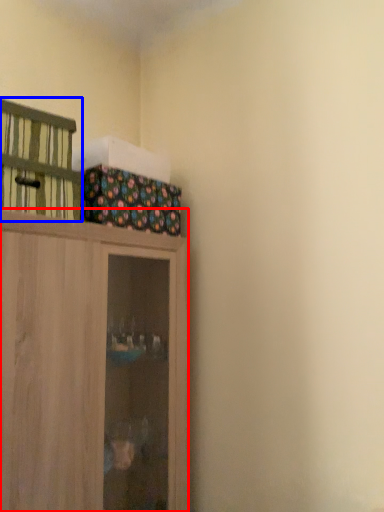
Question: Which object appears farthest to the camera in this image, cupboard (highlighted by a red box) or cabinetry (highlighted by a blue box)?

Choices:
 (A) cupboard
 (B) cabinetry

Answer: (B)